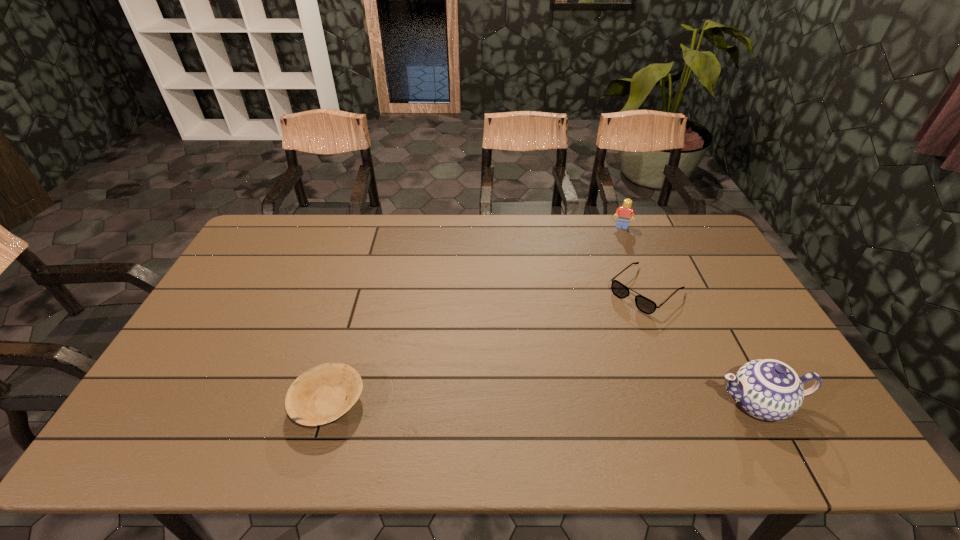
I want to click on free location located on the front-facing side of the second farthest object, so click(x=562, y=363).

In order to click on vacant space positioned on the front-facing side of the second farthest object in this screenshot , I will do pyautogui.click(x=583, y=346).

Image resolution: width=960 pixels, height=540 pixels. What are the coordinates of `free space located 0.330m on the front-facing side of the farthest object` in the screenshot? It's located at (610, 287).

This screenshot has width=960, height=540. Find the location of `free space located 0.320m on the front-facing side of the farthest object`. free space located 0.320m on the front-facing side of the farthest object is located at coordinates (611, 285).

Find the location of a particular element. free space located 0.260m on the front-facing side of the farthest object is located at coordinates (612, 274).

The width and height of the screenshot is (960, 540). Find the location of `object situated at the far edge`. object situated at the far edge is located at coordinates (624, 213).

This screenshot has width=960, height=540. Find the location of `bowl that is positioned at the near edge`. bowl that is positioned at the near edge is located at coordinates pos(318,396).

The height and width of the screenshot is (540, 960). I want to click on chinaware at the near edge, so click(x=768, y=389).

This screenshot has height=540, width=960. Find the location of `object that is at the right edge`. object that is at the right edge is located at coordinates (768, 389).

Locate an element on the screen. This screenshot has width=960, height=540. object present at the near right corner is located at coordinates (768, 389).